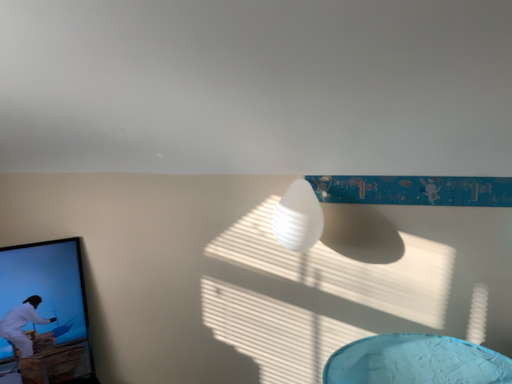
Question: Could black glossy picture frame at left be considered to be inside white matte lamp at center?

Choices:
 (A) yes
 (B) no

Answer: (B)

Question: Considering the relative positions of white matte lamp at center and black glossy picture frame at left in the image provided, is white matte lamp at center to the left of black glossy picture frame at left from the viewer's perspective?

Choices:
 (A) yes
 (B) no

Answer: (B)

Question: Does white matte lamp at center have a greater width compared to black glossy picture frame at left?

Choices:
 (A) no
 (B) yes

Answer: (A)

Question: Does white matte lamp at center have a smaller size compared to black glossy picture frame at left?

Choices:
 (A) yes
 (B) no

Answer: (A)

Question: Is white matte lamp at center in contact with black glossy picture frame at left?

Choices:
 (A) no
 (B) yes

Answer: (A)

Question: From the image's perspective, would you say white matte lamp at center is positioned over black glossy picture frame at left?

Choices:
 (A) no
 (B) yes

Answer: (B)

Question: Does black glossy picture frame at left have a lesser height compared to white matte lamp at center?

Choices:
 (A) yes
 (B) no

Answer: (B)

Question: Does black glossy picture frame at left have a greater height compared to white matte lamp at center?

Choices:
 (A) no
 (B) yes

Answer: (B)

Question: Is black glossy picture frame at left at the right side of white matte lamp at center?

Choices:
 (A) no
 (B) yes

Answer: (A)

Question: Does black glossy picture frame at left come in front of white matte lamp at center?

Choices:
 (A) no
 (B) yes

Answer: (A)

Question: Is black glossy picture frame at left facing away from white matte lamp at center?

Choices:
 (A) yes
 (B) no

Answer: (B)

Question: From a real-world perspective, is black glossy picture frame at left on white matte lamp at center?

Choices:
 (A) no
 (B) yes

Answer: (A)

Question: Is white matte lamp at center wider or thinner than black glossy picture frame at left?

Choices:
 (A) wide
 (B) thin

Answer: (B)